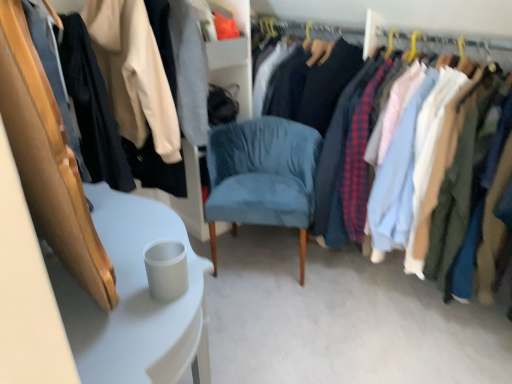
Locate an element on the screen. This screenshot has height=384, width=512. free space in front of suede blue chair at center is located at coordinates (284, 322).